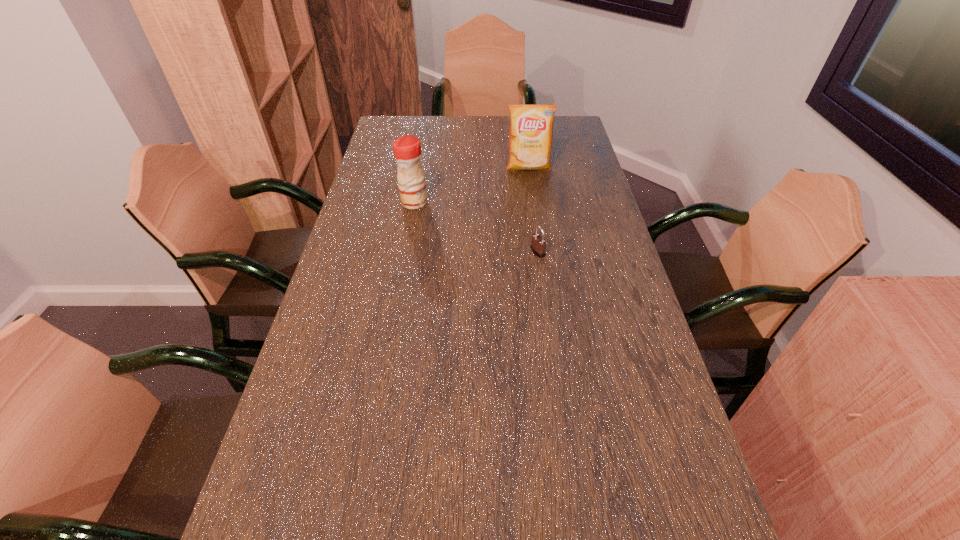
Where is `vacant space at the far edge of the desktop`? Image resolution: width=960 pixels, height=540 pixels. vacant space at the far edge of the desktop is located at coordinates [478, 127].

You are a GUI agent. You are given a task and a screenshot of the screen. Output one action in this format:
    pyautogui.click(x=<x>, y=<y>)
    Task: Click on the blank area at the left edge
    
    Given the screenshot: What is the action you would take?
    click(329, 517)

The image size is (960, 540). I want to click on blank area at the right edge, so click(575, 291).

In the image, there is a desktop. Where is `vacant space at the far left corner`? vacant space at the far left corner is located at coordinates (419, 136).

Where is `vacant space that's between the farthest object and the nearest object`? The image size is (960, 540). vacant space that's between the farthest object and the nearest object is located at coordinates (533, 210).

Find the location of a particular element. empty location between the shortest object and the leftmost object is located at coordinates 476,227.

The height and width of the screenshot is (540, 960). What are the coordinates of `free space between the second nearest object and the crisp (potato chip)` in the screenshot? It's located at (471, 185).

Find the location of a particular element. This screenshot has width=960, height=540. free space between the leftmost object and the nearest object is located at coordinates (476, 227).

The height and width of the screenshot is (540, 960). I want to click on free spot between the padlock and the farthest object, so click(533, 210).

Image resolution: width=960 pixels, height=540 pixels. In order to click on free area in between the padlock and the condiment in this screenshot , I will do `click(476, 227)`.